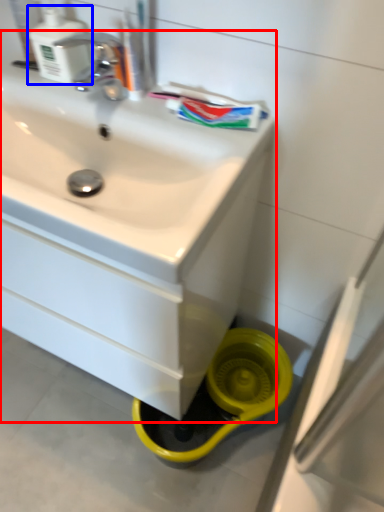
Question: Which point is further to the camera, sink (highlighted by a red box) or soap dispenser (highlighted by a blue box)?

Choices:
 (A) sink
 (B) soap dispenser

Answer: (B)